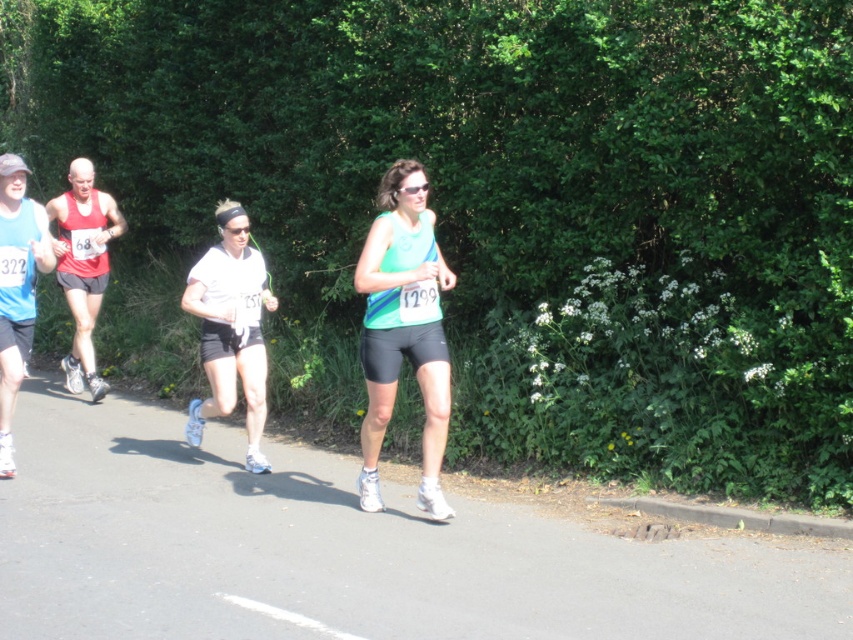
The image size is (853, 640). I want to click on matte green tank top at center, so click(x=403, y=328).

Can you confirm if matte green tank top at center is smaller than white matte shorts at center?

Yes, matte green tank top at center is smaller than white matte shorts at center.

Find the location of `matte green tank top at center`. matte green tank top at center is located at coordinates coord(403,328).

Can you confirm if white matte shorts at center is wider than matte blue tank top at left?

Correct, the width of white matte shorts at center exceeds that of matte blue tank top at left.

Does white matte shorts at center lie in front of matte blue tank top at left?

No, it is behind matte blue tank top at left.

Describe the element at coordinates (230, 330) in the screenshot. I see `white matte shorts at center` at that location.

Locate an element on the screen. white matte shorts at center is located at coordinates (230, 330).

Does matte green tank top at center have a greater height compared to matte blue tank top at left?

In fact, matte green tank top at center may be shorter than matte blue tank top at left.

Is matte green tank top at center wider than matte blue tank top at left?

Correct, the width of matte green tank top at center exceeds that of matte blue tank top at left.

Who is more distant from viewer, (399,278) or (33,273)?

Positioned behind is point (33,273).

You are a GUI agent. You are given a task and a screenshot of the screen. Output one action in this format:
    pyautogui.click(x=<x>, y=<y>)
    Task: Click on the matte green tank top at center
    
    Given the screenshot: What is the action you would take?
    pyautogui.click(x=403, y=328)